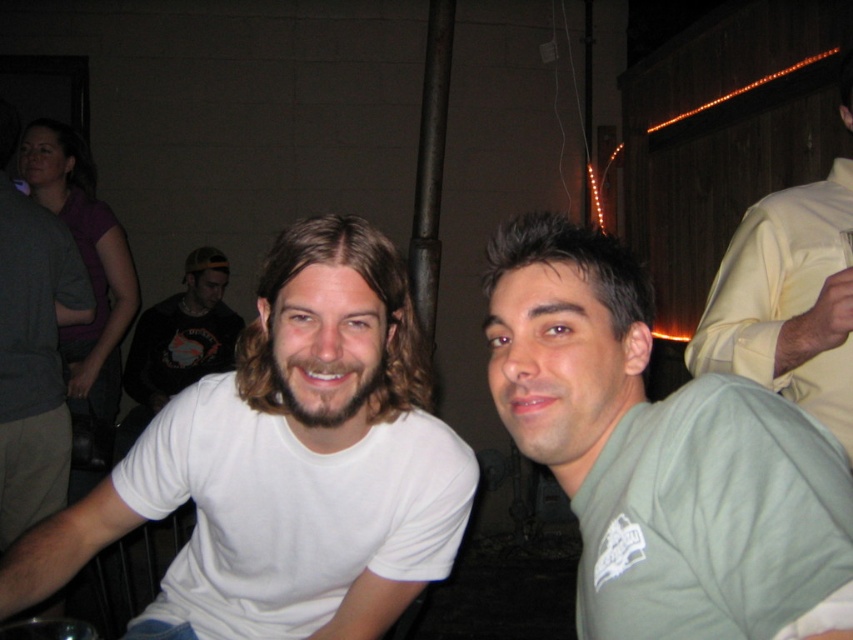
Question: Is white matte t-shirt at left positioned behind green cotton shirt at center?

Choices:
 (A) no
 (B) yes

Answer: (B)

Question: Does white matte t-shirt at left appear on the left side of dark gray shirt at left?

Choices:
 (A) no
 (B) yes

Answer: (A)

Question: Among these objects, which one is farthest from the camera?

Choices:
 (A) dark gray shirt at left
 (B) green cotton shirt at center
 (C) black cotton shirt at center
 (D) yellow smooth shirt at upper right

Answer: (C)

Question: Is green cotton shirt at center below yellow smooth shirt at upper right?

Choices:
 (A) yes
 (B) no

Answer: (A)

Question: Which object appears closest to the camera in this image?

Choices:
 (A) dark gray shirt at left
 (B) green cotton shirt at center
 (C) white matte t-shirt at left
 (D) yellow smooth shirt at upper right

Answer: (B)

Question: Estimate the real-world distances between objects in this image. Which object is closer to the yellow smooth shirt at upper right?

Choices:
 (A) white matte t-shirt at left
 (B) green cotton shirt at center
 (C) dark gray shirt at left
 (D) black cotton shirt at center

Answer: (B)